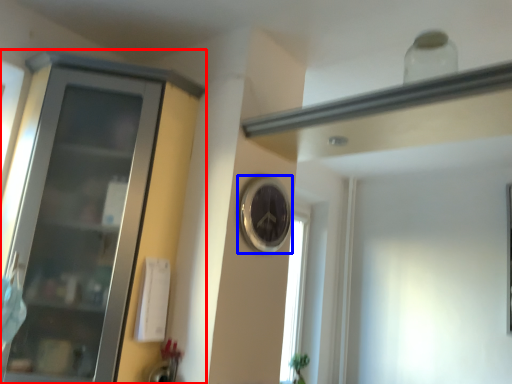
Question: Which point is further to the camera, cupboard (highlighted by a red box) or clock (highlighted by a blue box)?

Choices:
 (A) cupboard
 (B) clock

Answer: (B)